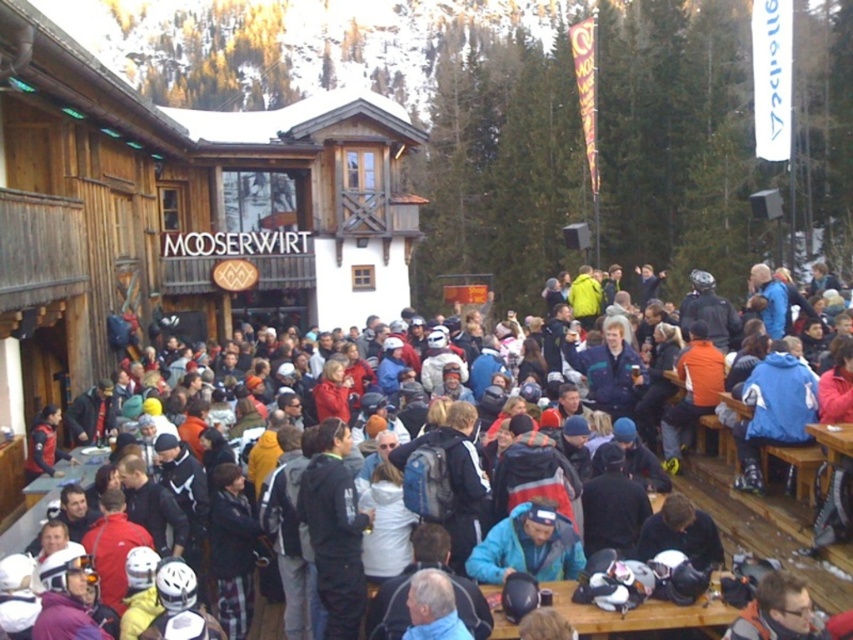
From the picture: What is the point at (178,212) located on in the scene?

The point at (178,212) is located on the wooden cabin at center.

You are planning to take a photo of the wooden cabin at center and the multicolored jackets at center. Considering their sizes, which object should you focus on first to ensure both are in frame?

The wooden cabin at center is larger in size than the multicolored jackets at center, so you should focus on the wooden cabin at center first to ensure both fit within the frame.

You are a photographer trying to capture a photo of the wooden cabin at center and the multicolored jackets at center. Which object should you zoom in on to make them appear the same size in the photo?

The wooden cabin at center is thinner than the multicolored jackets at center, so you should zoom in on the wooden cabin at center to make them appear the same size in the photo.